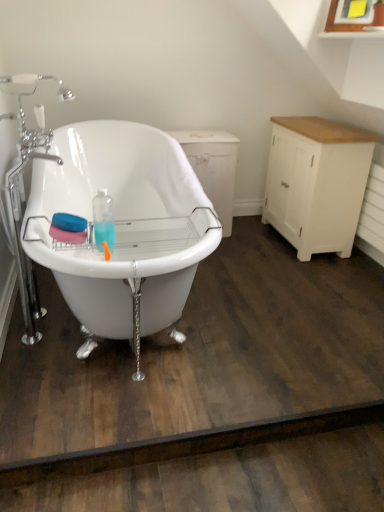
Where is `vacant space to the left of white painted wood cabinet at right`? The image size is (384, 512). vacant space to the left of white painted wood cabinet at right is located at coordinates (250, 248).